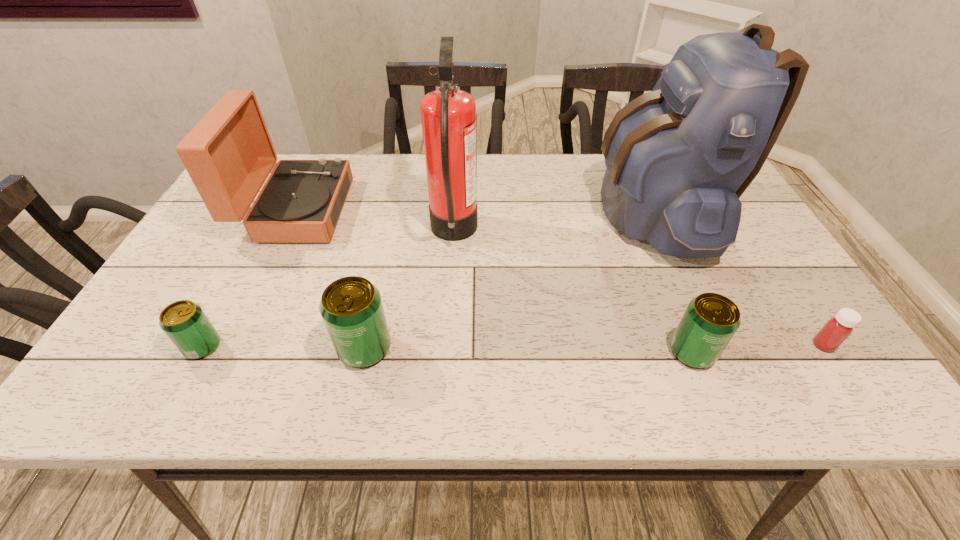
Locate which object ranks sixth in proximity to the shortest beer can. Please provide its 2D coordinates. Your answer should be formatted as a tuple, i.e. [(x, y)], where the tuple contains the x and y coordinates of a point satisfying the conditions above.

[(837, 329)]

This screenshot has width=960, height=540. I want to click on object that ranks as the second closest to the shortest beer can, so click(229, 154).

Choose which beer can is the second nearest neighbor to the fifth tallest object. Please provide its 2D coordinates. Your answer should be formatted as a tuple, i.e. [(x, y)], where the tuple contains the x and y coordinates of a point satisfying the conditions above.

[(184, 322)]

Select which beer can appears as the closest to the leftmost beer can. Please provide its 2D coordinates. Your answer should be formatted as a tuple, i.e. [(x, y)], where the tuple contains the x and y coordinates of a point satisfying the conditions above.

[(351, 307)]

The image size is (960, 540). In order to click on free location that satisfies the following two spatial constraints: 1. at the front pocket of the backpack; 2. on the right side of the medicine in this screenshot , I will do `click(712, 345)`.